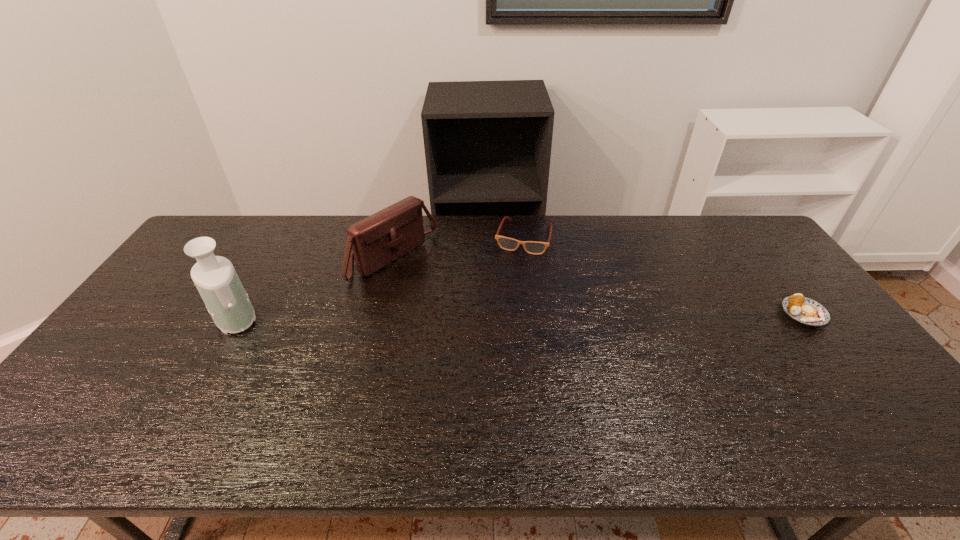
This screenshot has height=540, width=960. I want to click on free space between the shoulder bag and the rightmost object, so click(x=599, y=286).

Identify the location of free space between the pastry and the spectacles. This screenshot has width=960, height=540. [663, 276].

The height and width of the screenshot is (540, 960). I want to click on empty location between the third tallest object and the pastry, so click(663, 276).

At what (x,y) coordinates should I click in order to perform the action: click on free spot between the third tallest object and the juicer. Please return your answer as a coordinate pair (x, y). This screenshot has height=540, width=960. Looking at the image, I should click on (377, 277).

Identify which object is located as the third nearest to the tallest object. Please provide its 2D coordinates. Your answer should be formatted as a tuple, i.e. [(x, y)], where the tuple contains the x and y coordinates of a point satisfying the conditions above.

[(805, 310)]

Locate which object is the second closest to the second object from left to right. Please provide its 2D coordinates. Your answer should be formatted as a tuple, i.e. [(x, y)], where the tuple contains the x and y coordinates of a point satisfying the conditions above.

[(215, 278)]

The image size is (960, 540). Find the location of `vacant space that satisfies the following two spatial constraints: 1. on the back side of the juicer; 2. on the right side of the third object from left to right`. vacant space that satisfies the following two spatial constraints: 1. on the back side of the juicer; 2. on the right side of the third object from left to right is located at coordinates (278, 238).

Locate an element on the screen. This screenshot has width=960, height=540. free spot that satisfies the following two spatial constraints: 1. on the front side of the third object from left to right; 2. on the right side of the pastry is located at coordinates (532, 314).

The width and height of the screenshot is (960, 540). Find the location of `free space that satisfies the following two spatial constraints: 1. on the front side of the spectacles; 2. on the left side of the rightmost object`. free space that satisfies the following two spatial constraints: 1. on the front side of the spectacles; 2. on the left side of the rightmost object is located at coordinates (532, 314).